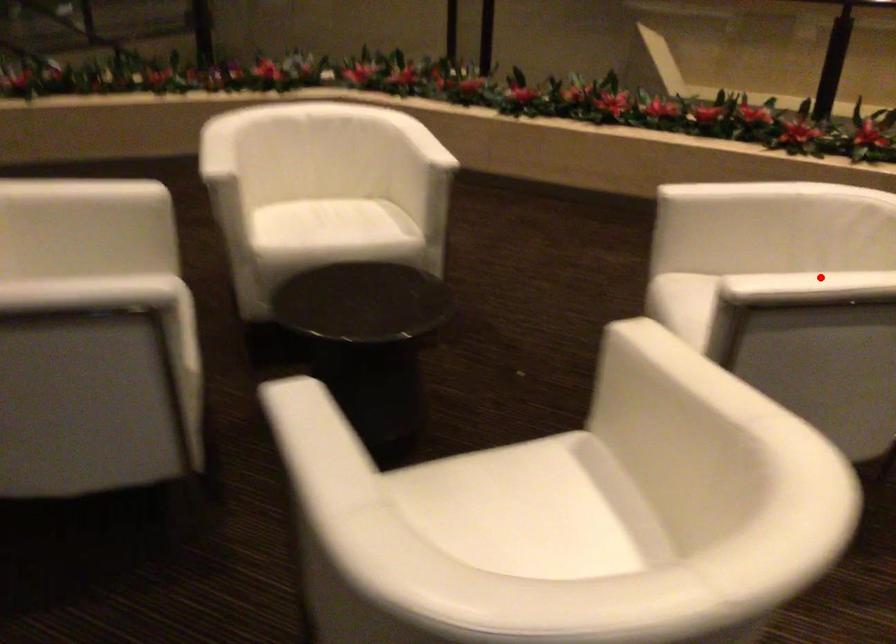
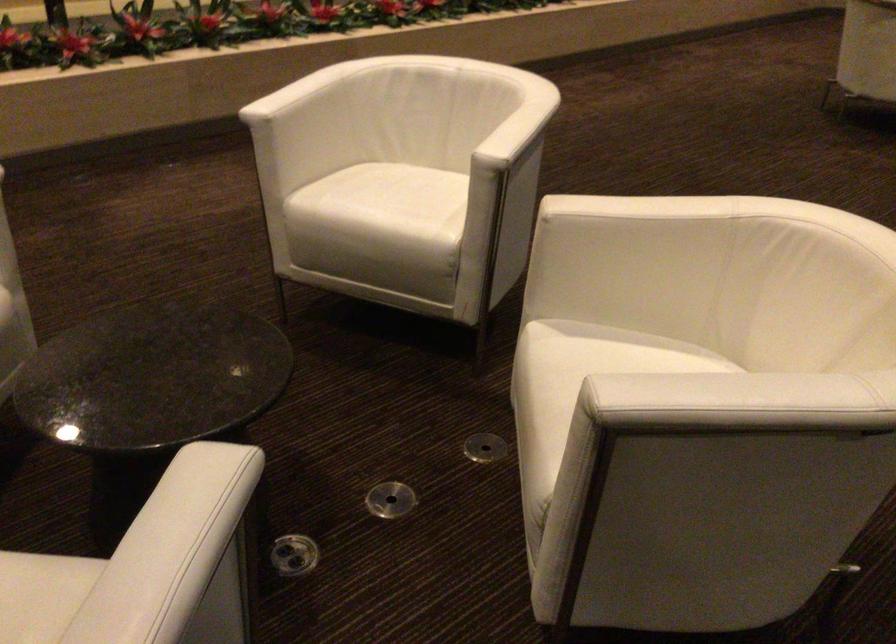
Question: I am providing you with two images of the same scene from different viewpoints. A red point is marked on the first image. Is the red point's position out of view in image 2?

Choices:
 (A) Yes
 (B) No

Answer: (B)